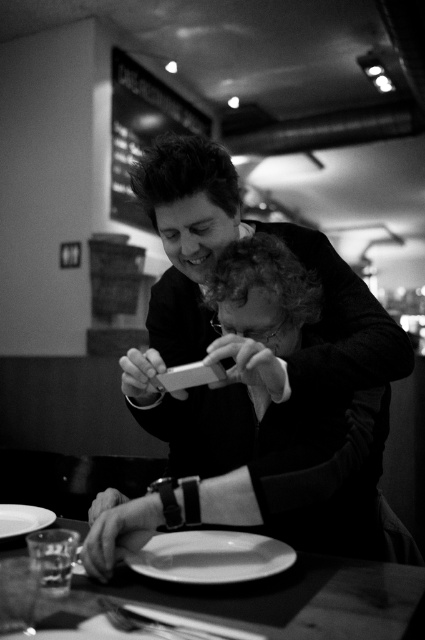
Question: Is smooth plastic phone at center to the right of white matte plate at lower left from the viewer's perspective?

Choices:
 (A) yes
 (B) no

Answer: (A)

Question: Among these points, which one is nearest to the camera?

Choices:
 (A) (248, 568)
 (B) (28, 516)

Answer: (A)

Question: Can you confirm if smooth plastic phone at center is smaller than white matte plate at lower left?

Choices:
 (A) yes
 (B) no

Answer: (B)

Question: Is smooth wooden table at center further to camera compared to white glossy plate at lower center?

Choices:
 (A) no
 (B) yes

Answer: (A)

Question: Which of the following is the farthest from the observer?

Choices:
 (A) (138, 371)
 (B) (388, 614)

Answer: (A)

Question: Which point is closer to the camera taking this photo?

Choices:
 (A) (218, 557)
 (B) (291, 609)
 (C) (51, 518)
 (D) (302, 515)

Answer: (B)